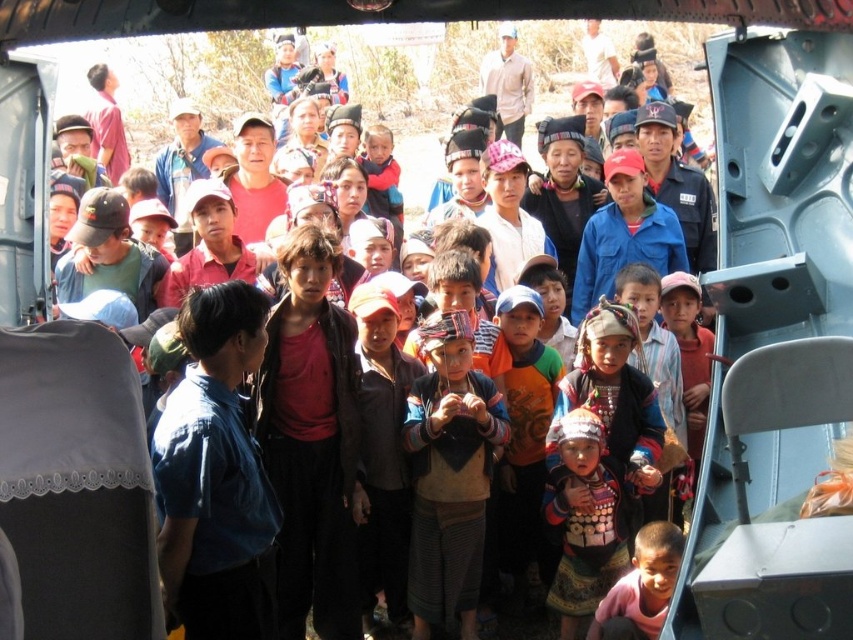
You are a photographer trying to capture a photo of the multicolored fabric at center and the pink fabric shirt at lower right. Which object should you focus on first if you want to include both in your frame without moving the camera?

The multicolored fabric at center is much taller than the pink fabric shirt at lower right, so you should focus on the multicolored fabric at center first to ensure it fits within the frame.

You are standing at the front of the group and want to take a photo that includes both point (485, 408) and point (657, 573). Since you need to ensure both points are visible, which point should be closer to the camera to avoid being blocked by the group?

Point (657, 573) should be closer to the camera because point (485, 408) is behind it, so positioning the camera to have point (657, 573) in front will ensure both are visible without obstruction.